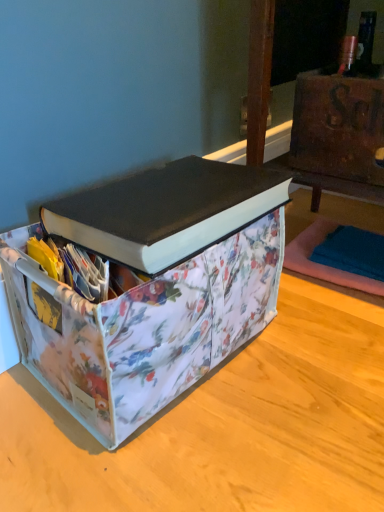
Identify the location of vacant space to the right of floral fabric storage bin at center. Image resolution: width=384 pixels, height=512 pixels. (310, 361).